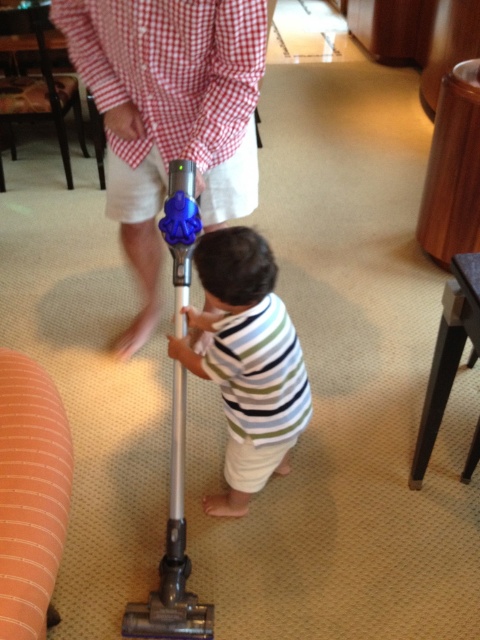
Question: Which point appears closest to the camera in this image?

Choices:
 (A) (165, 104)
 (B) (287, 392)

Answer: (B)

Question: Is checkered fabric shirt at upper center wider than striped cotton shirt at center?

Choices:
 (A) no
 (B) yes

Answer: (B)

Question: Considering the relative positions of checkered fabric shirt at upper center and striped cotton shirt at center in the image provided, where is checkered fabric shirt at upper center located with respect to striped cotton shirt at center?

Choices:
 (A) left
 (B) right

Answer: (A)

Question: Among these objects, which one is farthest from the camera?

Choices:
 (A) striped cotton shirt at center
 (B) checkered fabric shirt at upper center

Answer: (B)

Question: Does checkered fabric shirt at upper center have a smaller size compared to striped cotton shirt at center?

Choices:
 (A) no
 (B) yes

Answer: (B)